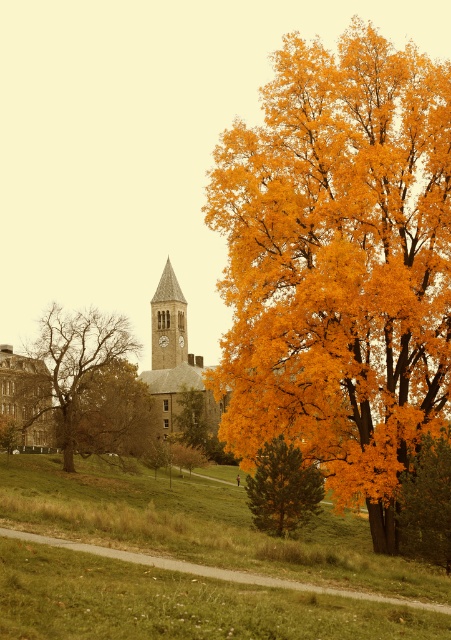
You are standing in front of the historic building with the clock tower. You notice two points marked on the ground. The first point is at coordinates point (385, 381) and the second is at point (10, 444). Which point is closer to you?

Point (385, 381) is in front of point (10, 444), so the first point is closer to you.

You are a landscape architect designing a garden path that needs to pass between the green grassy at lower left and the golden textured tree at center. Which area requires more space to accommodate the path?

The green grassy at lower left is larger in size than the golden textured tree at center, so the path should be designed to accommodate the larger area of the green grassy at lower left.

You are standing at the point marked as point (109,497). You want to walk directly towards the clock tower in the background. Is the large tree on the right side of the frame blocking your path? Please explain your reasoning.

The point (109,497) and the clock tower are 96.55 meters apart. Since the large tree on the right side of the frame is not mentioned as being in between them, it is likely not blocking the path. However, the exact position of the tree relative to the path is not provided, so this is an assumption based on available information.